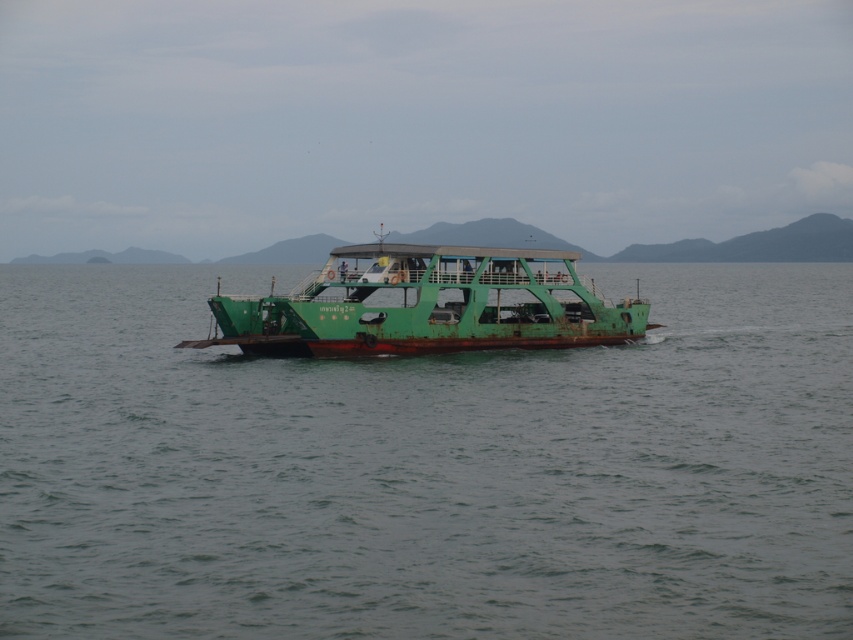
Is green matte water at center thinner than green matte boat at center?

Incorrect, green matte water at center's width is not less than green matte boat at center's.

Image resolution: width=853 pixels, height=640 pixels. I want to click on green matte water at center, so click(426, 468).

Locate an element on the screen. Image resolution: width=853 pixels, height=640 pixels. green matte water at center is located at coordinates (426, 468).